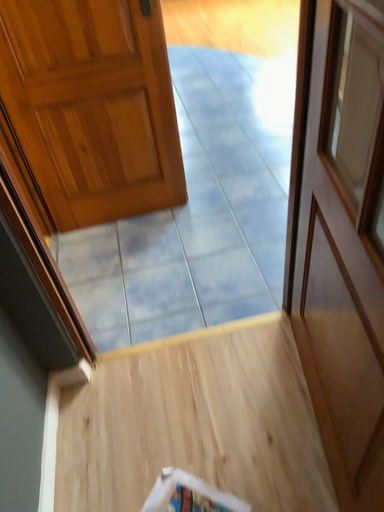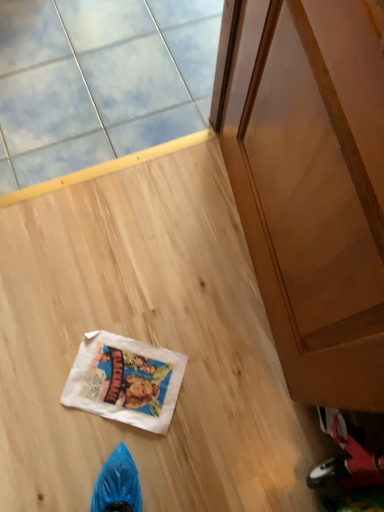
Question: Which way did the camera rotate in the video?

Choices:
 (A) rotated upward
 (B) rotated downward

Answer: (B)